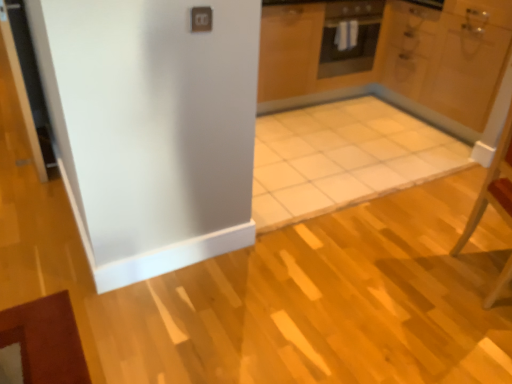
Question: Should I look upward or downward to see wooden chair at right?

Choices:
 (A) down
 (B) up

Answer: (A)

Question: Considering the relative positions of black matte oven at upper center and wooden chair at right in the image provided, is black matte oven at upper center to the right of wooden chair at right from the viewer's perspective?

Choices:
 (A) yes
 (B) no

Answer: (B)

Question: Is the depth of black matte oven at upper center greater than that of wooden chair at right?

Choices:
 (A) no
 (B) yes

Answer: (B)

Question: From the image's perspective, is black matte oven at upper center on top of wooden chair at right?

Choices:
 (A) yes
 (B) no

Answer: (A)

Question: Does black matte oven at upper center have a larger size compared to wooden chair at right?

Choices:
 (A) yes
 (B) no

Answer: (B)

Question: Considering the relative sizes of black matte oven at upper center and wooden chair at right in the image provided, is black matte oven at upper center shorter than wooden chair at right?

Choices:
 (A) yes
 (B) no

Answer: (A)

Question: Is black matte oven at upper center far from wooden chair at right?

Choices:
 (A) no
 (B) yes

Answer: (B)

Question: Could you tell me if white glossy door at upper right is turned towards wooden chair at right?

Choices:
 (A) no
 (B) yes

Answer: (A)

Question: From the image's perspective, is white glossy door at upper right over wooden chair at right?

Choices:
 (A) no
 (B) yes

Answer: (B)

Question: Does white glossy door at upper right have a larger size compared to wooden chair at right?

Choices:
 (A) yes
 (B) no

Answer: (A)

Question: Considering the relative positions of white glossy door at upper right and wooden chair at right in the image provided, is white glossy door at upper right in front of wooden chair at right?

Choices:
 (A) yes
 (B) no

Answer: (B)

Question: Considering the relative sizes of white glossy door at upper right and wooden chair at right in the image provided, is white glossy door at upper right shorter than wooden chair at right?

Choices:
 (A) no
 (B) yes

Answer: (A)

Question: Can you confirm if white glossy door at upper right is thinner than wooden chair at right?

Choices:
 (A) yes
 (B) no

Answer: (B)

Question: Is the position of black matte oven at upper center less distant than that of white glossy door at upper right?

Choices:
 (A) yes
 (B) no

Answer: (B)